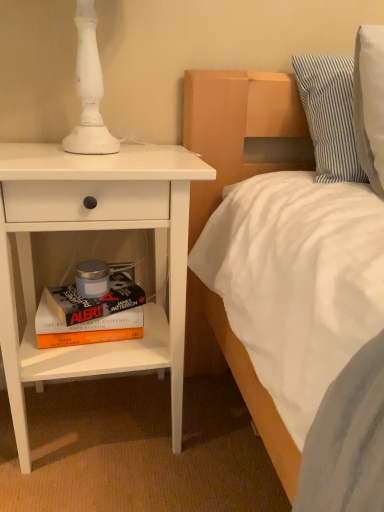
In order to click on vacant space underneath white matte nightstand at left (from a real-world perspective) in this screenshot , I will do `click(99, 418)`.